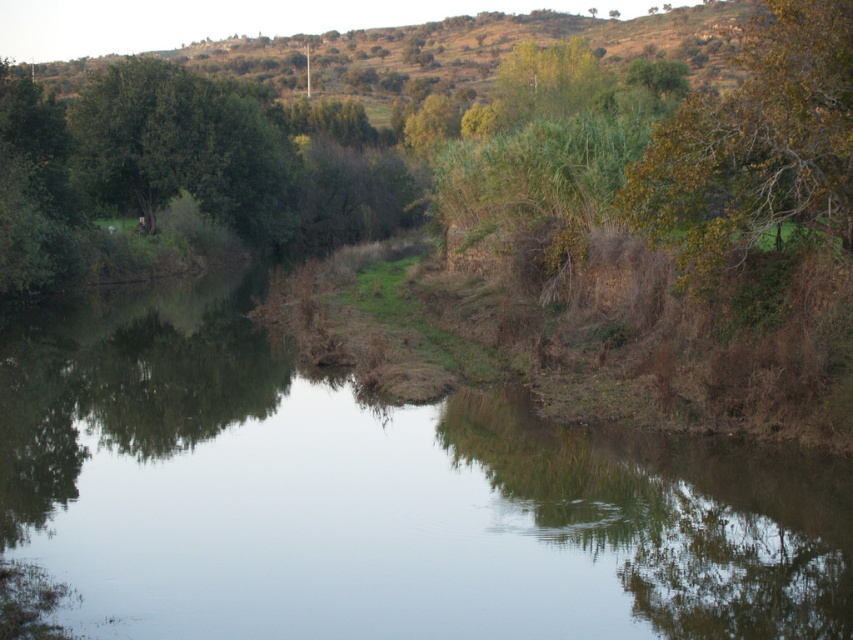
You are standing at the edge of the water in the scene and see two points marked in the image. Which point, point (808, 493) or point (758, 90), is closer to you?

Point (808, 493) is closer to the viewer than point (758, 90).

You are standing at the edge of the green grassy bank at center and want to walk towards the green leafy tree at upper right. Which direction should you head to reach it?

To reach the green leafy tree at upper right from the green grassy bank at center, you should head towards the upper right direction since the tree is located in that direction relative to the bank.